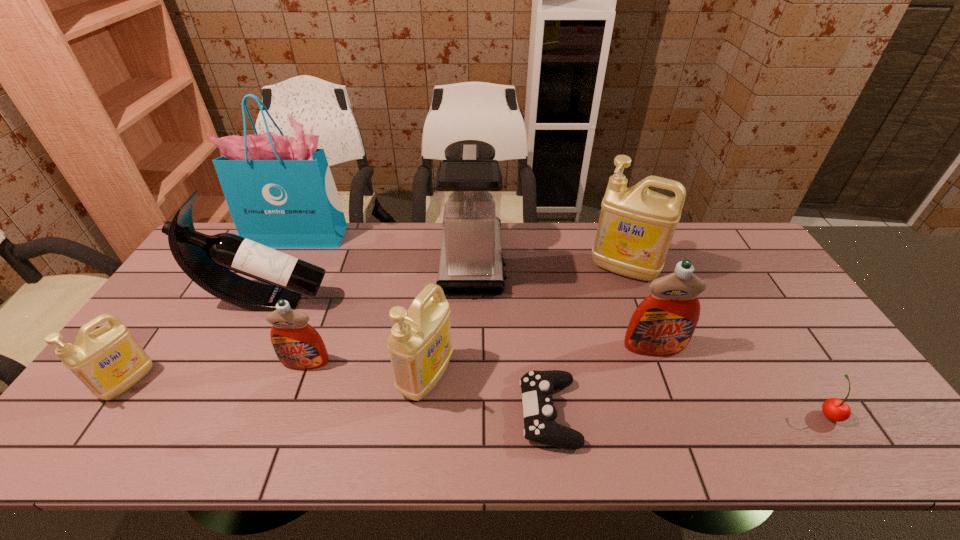
At what (x,y) coordinates should I click in order to perform the action: click on coffee maker at the far edge. Please return your answer as a coordinate pair (x, y). Looking at the image, I should click on (468, 186).

The image size is (960, 540). Identify the location of detergent positioned at the far edge. [x=636, y=225].

Identify the location of cherry that is at the near edge. The height and width of the screenshot is (540, 960). (834, 409).

Locate an element on the screen. The image size is (960, 540). control present at the near edge is located at coordinates (537, 387).

What are the coordinates of `shopping bag that is at the left edge` in the screenshot? It's located at (280, 191).

Where is `wine bottle that is at the left edge`? This screenshot has width=960, height=540. wine bottle that is at the left edge is located at coordinates (207, 260).

Find the location of a particular element. The height and width of the screenshot is (540, 960). detergent that is positioned at the left edge is located at coordinates (109, 360).

At what (x,y) coordinates should I click in order to perform the action: click on object that is at the right edge. Please return your answer as a coordinate pair (x, y). The image size is (960, 540). Looking at the image, I should click on (834, 409).

The height and width of the screenshot is (540, 960). Identify the location of object present at the far left corner. (280, 191).

The height and width of the screenshot is (540, 960). In order to click on object present at the near right corner in this screenshot , I will do `click(834, 409)`.